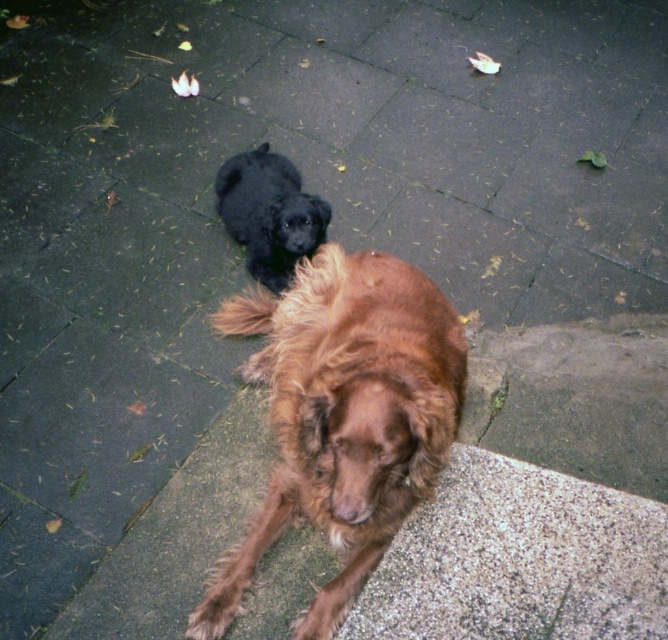
Question: Is brown furry dog at center positioned before shiny black fur at upper center?

Choices:
 (A) no
 (B) yes

Answer: (B)

Question: Does brown furry dog at center have a lesser width compared to shiny black fur at upper center?

Choices:
 (A) yes
 (B) no

Answer: (B)

Question: Which point appears farthest from the camera in this image?

Choices:
 (A) (281, 182)
 (B) (236, 330)

Answer: (A)

Question: Which point appears closest to the camera in this image?

Choices:
 (A) (295, 253)
 (B) (407, 412)

Answer: (B)

Question: From the image, what is the correct spatial relationship of brown furry dog at center in relation to shiny black fur at upper center?

Choices:
 (A) left
 (B) right

Answer: (B)